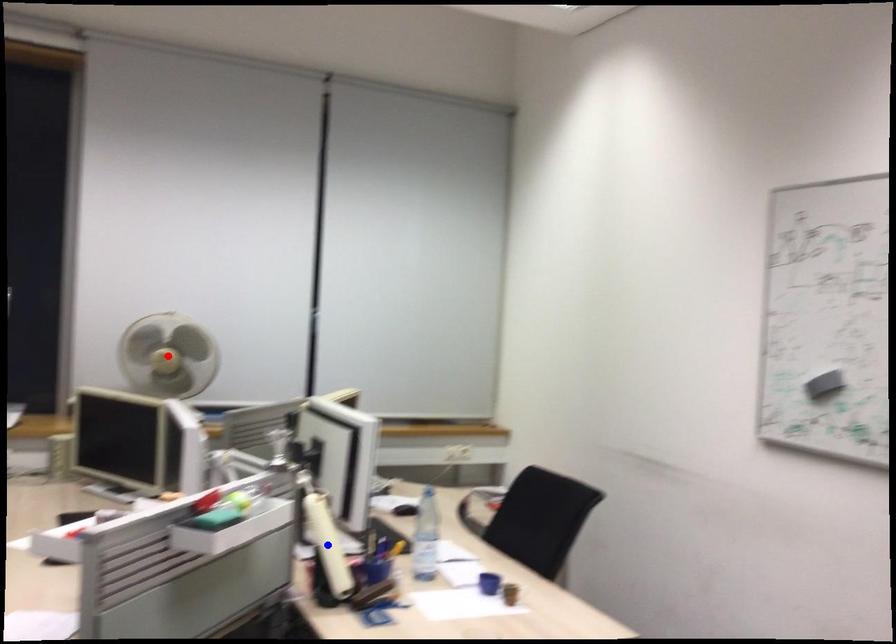
Question: Which of the two points in the image is closer to the camera?

Choices:
 (A) Blue point is closer.
 (B) Red point is closer.

Answer: (A)